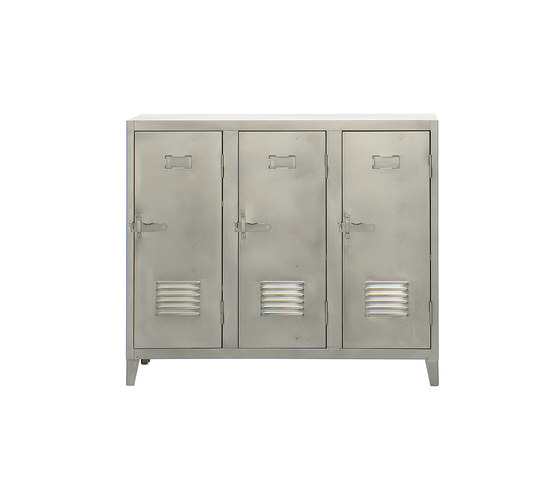
This screenshot has height=478, width=560. In order to click on top surface' in this screenshot , I will do `click(244, 116)`.